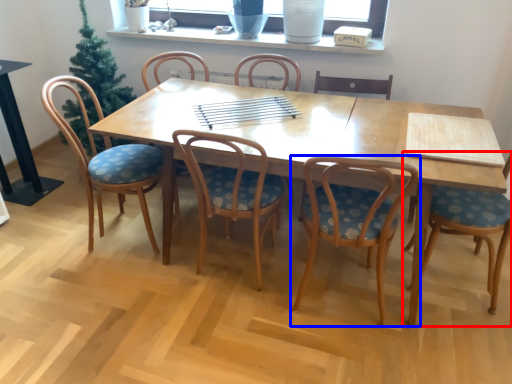
Question: Which of the following is the closest to the observer, chair (highlighted by a red box) or chair (highlighted by a blue box)?

Choices:
 (A) chair
 (B) chair

Answer: (B)